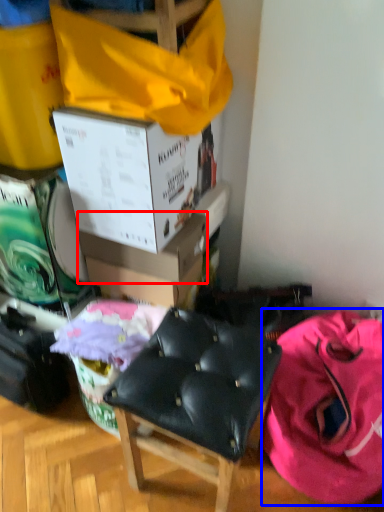
Question: Which point is further to the camera, box (highlighted by a red box) or clothing (highlighted by a blue box)?

Choices:
 (A) box
 (B) clothing

Answer: (A)